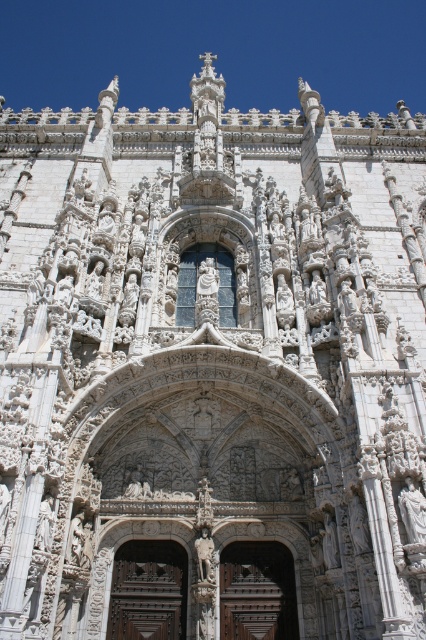
You are an architect inspecting the historic building. You notice two doors at the center of the facade. The first is labeled as the brown carved wood door at center, and the second is the brown wooden door at center. Which door is narrower?

The brown carved wood door at center is narrower than the brown wooden door at center.

You are an architect planning to install a new lighting fixture above the two doors. The fixture requires a minimum clearance of 25 feet between the doors to be safely mounted. Based on the provided information, will the proposed lighting fixture fit between the brown carved wood door at center and the brown wooden door at center?

The distance between the brown carved wood door at center and the brown wooden door at center is 24.61 feet, which is less than the required 25 feet clearance. Therefore, the proposed lighting fixture will not fit safely between them.